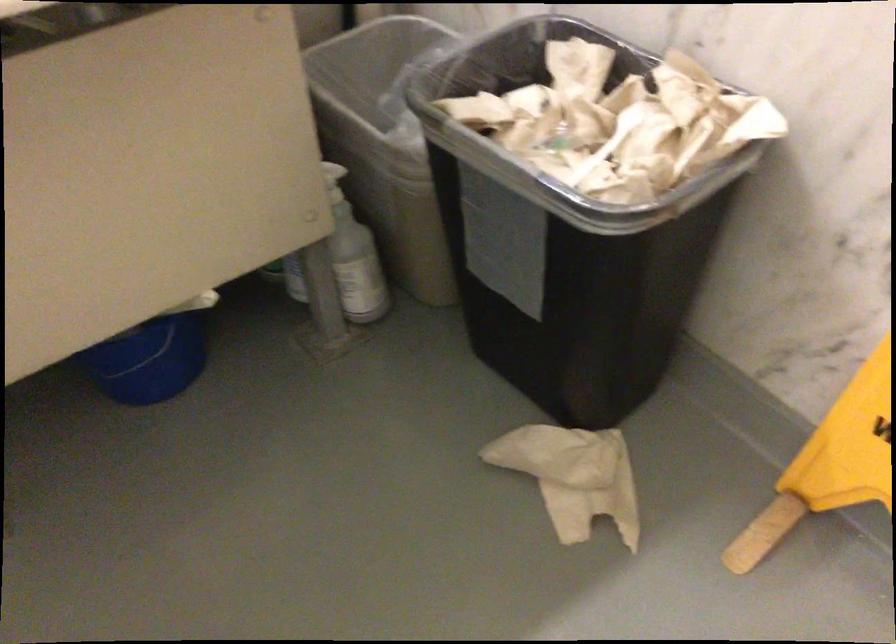
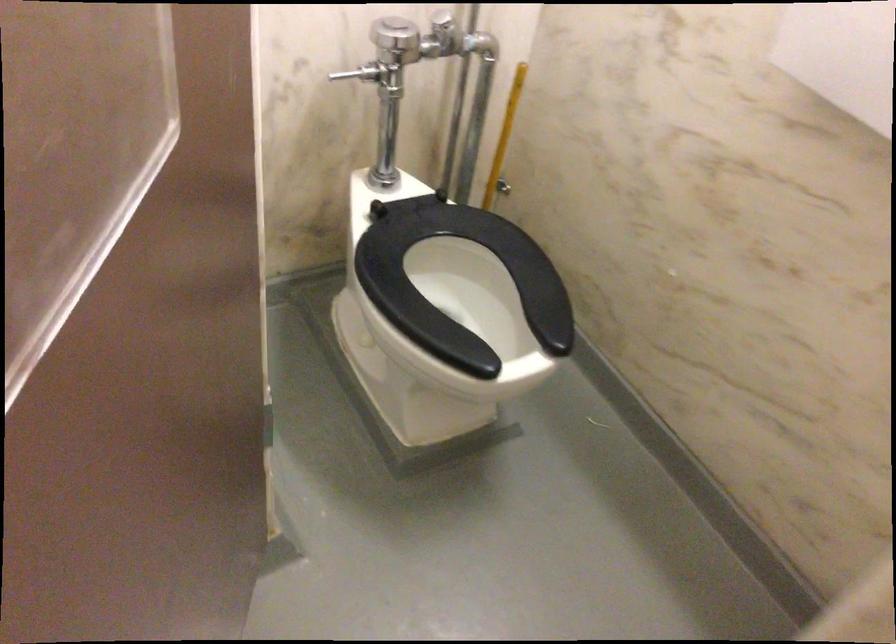
First-person continuous shooting, in which direction is the camera rotating?

The rotation direction of the camera is left-down.